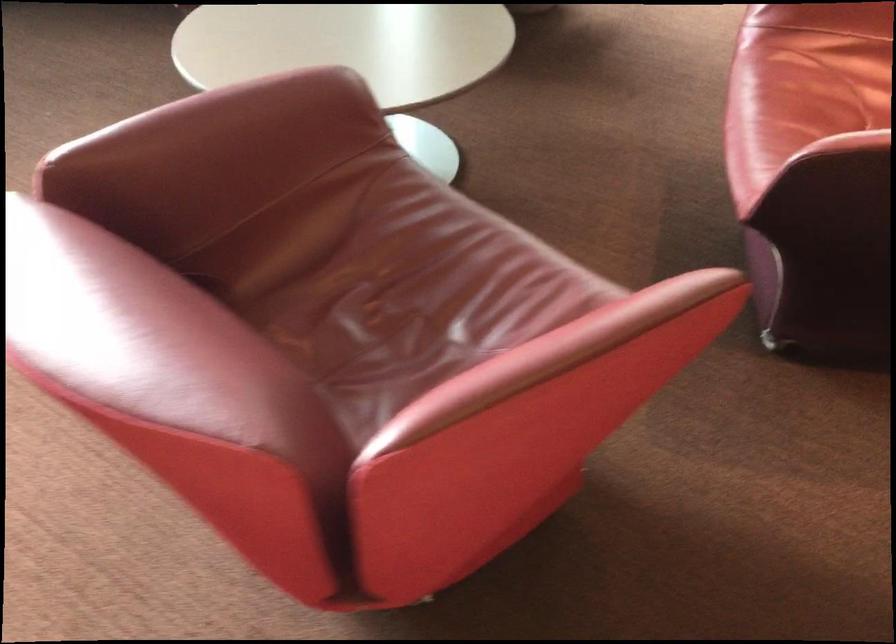
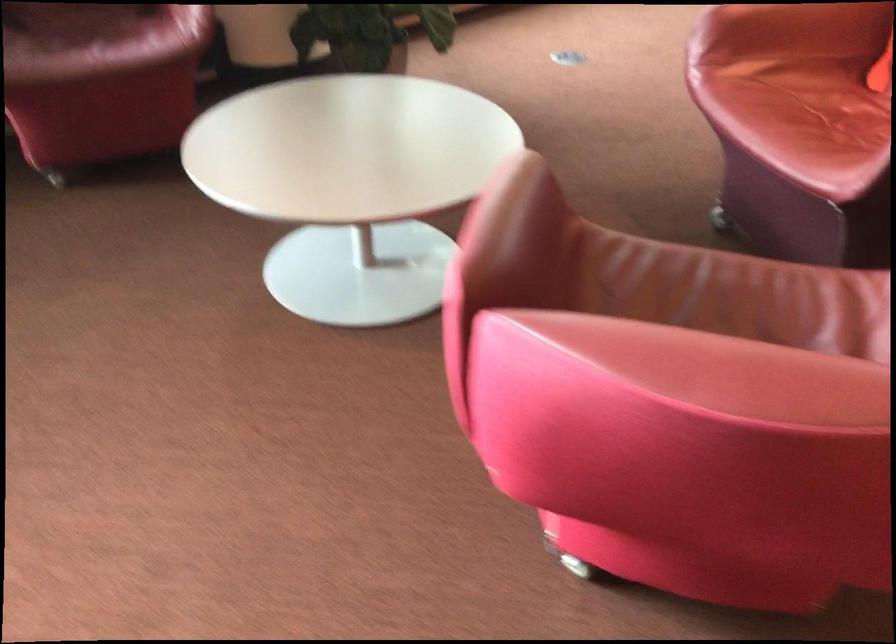
Question: Which direction would the cameraman need to move to produce the second image? Reply with the corresponding letter.

Choices:
 (A) Left
 (B) Right
 (C) Forward
 (D) Backward

Answer: (A)